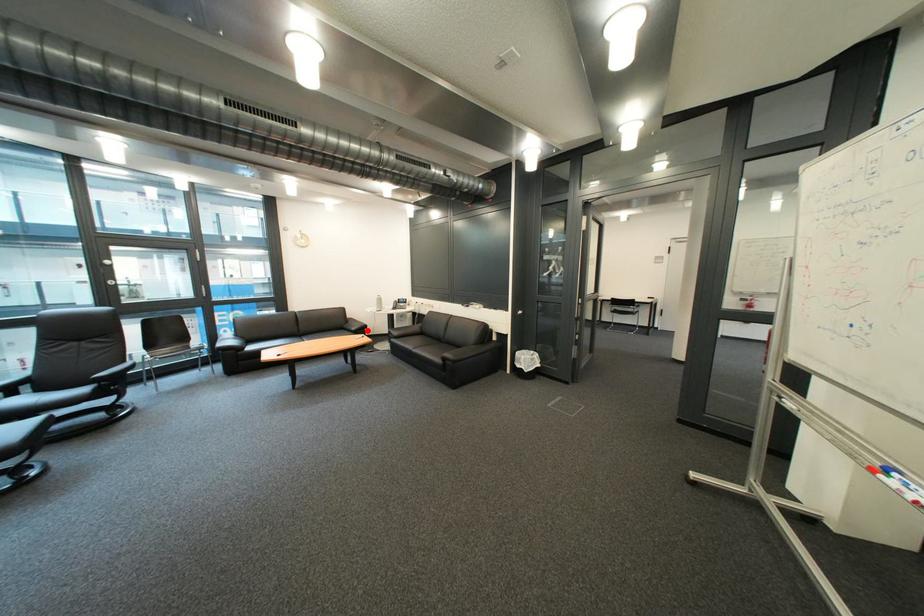
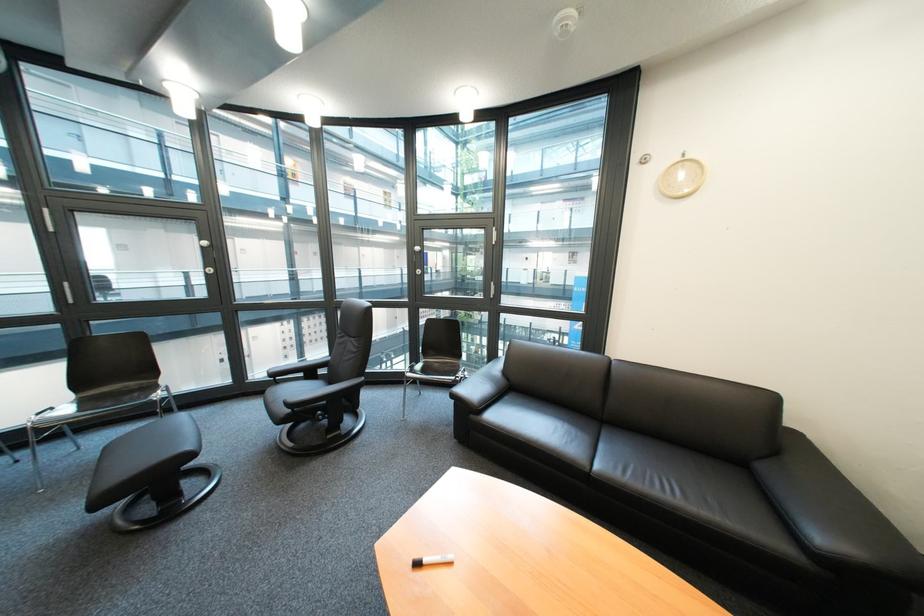
Question: A red point is marked in image1. In image2, is the corresponding 3D point closer to the camera or farther? Reply with the corresponding letter.

Choices:
 (A) The corresponding 3D point is closer.
 (B) The corresponding 3D point is farther.

Answer: (A)